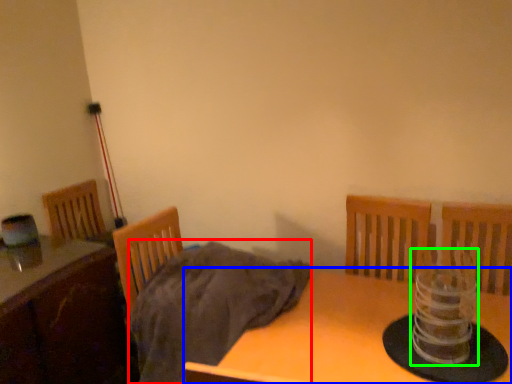
Question: Which object is the farthest from blanket (highlighted by a red box)? Choose among these: table (highlighted by a blue box) or candle holder (highlighted by a green box).

Choices:
 (A) table
 (B) candle holder

Answer: (B)